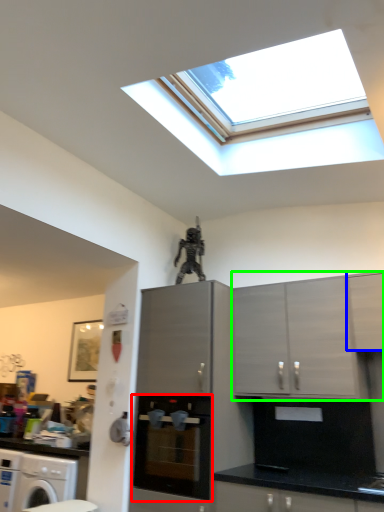
Question: Which object is positioned farthest from home appliance (highlighted by a red box)? Select from cabinetry (highlighted by a blue box) and cabinetry (highlighted by a green box).

Choices:
 (A) cabinetry
 (B) cabinetry

Answer: (A)